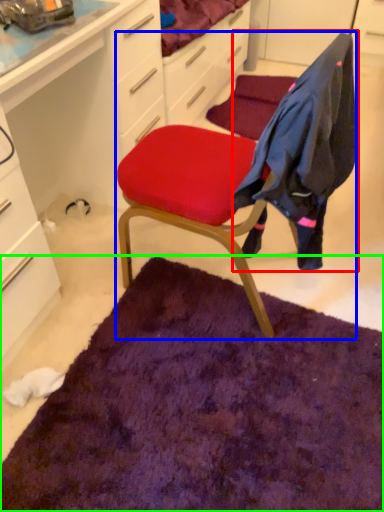
Question: Based on their relative distances, which object is nearer to clothing (highlighted by a red box)? Choose from chair (highlighted by a blue box) and mat (highlighted by a green box).

Choices:
 (A) chair
 (B) mat

Answer: (A)